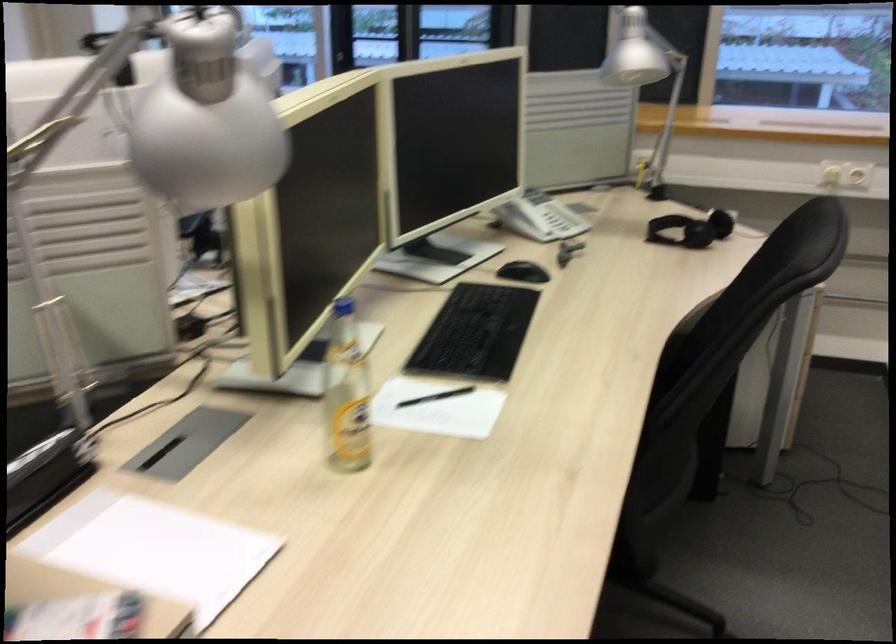
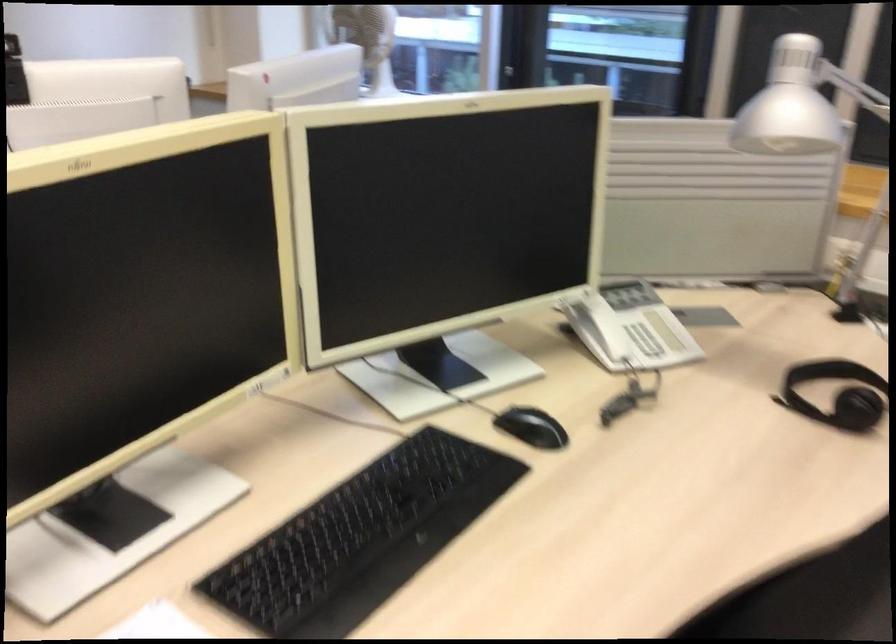
In the second image, find the point that corresponds to the point at 533,214 in the first image.

(604, 327)